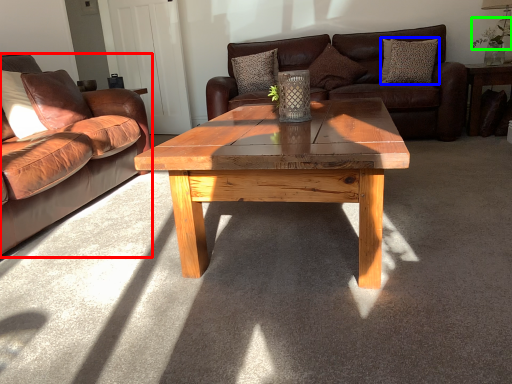
Question: Which object is the farthest from studio couch (highlighted by a red box)? Choose among these: pillow (highlighted by a blue box) or floral arrangement (highlighted by a green box).

Choices:
 (A) pillow
 (B) floral arrangement

Answer: (B)